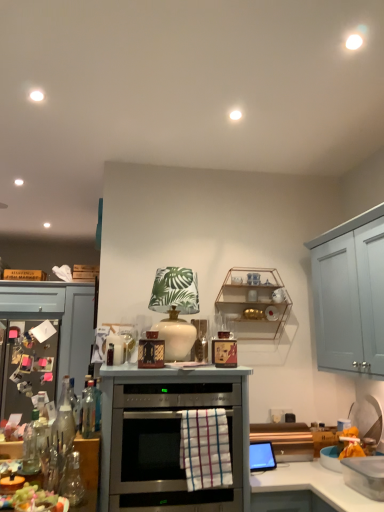
Where is `white ceramic lamp at center, positioned as the first appliance in back-to-front order`? white ceramic lamp at center, positioned as the first appliance in back-to-front order is located at coordinates (175, 309).

At what (x,y) coordinates should I click in order to perform the action: click on satin silver oven at center. Please return your answer as a coordinate pair (x, y). Image resolution: width=384 pixels, height=512 pixels. Looking at the image, I should click on (164, 433).

The height and width of the screenshot is (512, 384). What do you see at coordinates (34, 500) in the screenshot?
I see `translucent glass grapes at lower left` at bounding box center [34, 500].

In order to face clear glass bottle at lower left, the 1th bottle when ordered from left to right, should I rotate leftwards or rightwards?

To align with it, rotate left about 20.449°.

The height and width of the screenshot is (512, 384). What do you see at coordinates (31, 447) in the screenshot?
I see `clear glass bottle at lower left, the second bottle viewed from the right` at bounding box center [31, 447].

Describe the element at coordinates (254, 303) in the screenshot. I see `gold metallic shelf at upper center` at that location.

I want to click on white ceramic lamp at center, positioned as the first appliance in back-to-front order, so click(x=175, y=309).

Considering the relative sizes of translucent glass grapes at lower left and satin silver oven at center in the image provided, is translucent glass grapes at lower left taller than satin silver oven at center?

No, translucent glass grapes at lower left is not taller than satin silver oven at center.

Between translucent glass grapes at lower left and satin silver oven at center, which one has smaller width?

translucent glass grapes at lower left is thinner.

Is translucent glass grapes at lower left smaller than satin silver oven at center?

Yes, translucent glass grapes at lower left is smaller than satin silver oven at center.

What's the angular difference between translucent glass grapes at lower left and satin silver oven at center's facing directions?

translucent glass grapes at lower left and satin silver oven at center are facing 2.37 degrees away from each other.

Is clear glass bottle at center, arranged as the second bottle when viewed from the left, closer to camera compared to clear glass bottle at lower left, the 1th bottle when ordered from left to right?

No, it is behind clear glass bottle at lower left, the 1th bottle when ordered from left to right.

Is clear glass bottle at center, the first bottle when ordered from right to left, outside of clear glass bottle at lower left, the second bottle viewed from the right?

clear glass bottle at center, the first bottle when ordered from right to left, lies outside clear glass bottle at lower left, the second bottle viewed from the right,'s area.

From a real-world perspective, is clear glass bottle at center, arranged as the second bottle when viewed from the left, positioned above or below clear glass bottle at lower left, the second bottle viewed from the right?

In terms of real-world spatial position, clear glass bottle at center, arranged as the second bottle when viewed from the left, is above clear glass bottle at lower left, the second bottle viewed from the right.

Is white checkered towel at center surrounding clear plastic container at lower right, which appears as the second appliance when viewed from the top?

No, clear plastic container at lower right, which appears as the second appliance when viewed from the top, is not inside white checkered towel at center.

How different are the orientations of white checkered towel at center and clear plastic container at lower right, which appears as the second appliance when viewed from the top, in degrees?

The angular difference between white checkered towel at center and clear plastic container at lower right, which appears as the second appliance when viewed from the top, is 90 degrees.

In the scene shown: Who is smaller, white checkered towel at center or clear plastic container at lower right, positioned as the 2th appliance in left-to-right order?

With smaller size is white checkered towel at center.

From a real-world perspective, who is located higher, white checkered towel at center or clear plastic container at lower right, which appears as the second appliance when viewed from the back?

white checkered towel at center is physically above.

Could you tell me if clear plastic container at lower right, marked as the first appliance in a front-to-back arrangement, is facing satin silver oven at center?

Yes, clear plastic container at lower right, marked as the first appliance in a front-to-back arrangement, is aimed at satin silver oven at center.

The image size is (384, 512). I want to click on appliance in front of the satin silver oven at center, so click(x=365, y=475).

Is clear plastic container at lower right, marked as the first appliance in a front-to-back arrangement, positioned beyond the bounds of satin silver oven at center?

That's correct, clear plastic container at lower right, marked as the first appliance in a front-to-back arrangement, is outside of satin silver oven at center.

Which is behind, white checkered towel at center or white ceramic lamp at center, acting as the second appliance starting from the bottom?

white ceramic lamp at center, acting as the second appliance starting from the bottom, is behind.

Can you confirm if white checkered towel at center is wider than white ceramic lamp at center, the 1th appliance in the top-to-bottom sequence?

Incorrect, the width of white checkered towel at center does not surpass that of white ceramic lamp at center, the 1th appliance in the top-to-bottom sequence.

Is white checkered towel at center not close to white ceramic lamp at center, the 2th appliance in the right-to-left sequence?

They are positioned close to each other.

How far apart are gold metallic shelf at upper center and white checkered towel at center?

gold metallic shelf at upper center is 36.76 inches away from white checkered towel at center.

From the image's perspective, who appears lower, gold metallic shelf at upper center or white checkered towel at center?

white checkered towel at center is shown below in the image.

In order to click on material below the gold metallic shelf at upper center (from the image's perspective) in this screenshot , I will do `click(205, 448)`.

From a real-world perspective, who is located lower, gold metallic shelf at upper center or white checkered towel at center?

From a 3D spatial view, white checkered towel at center is below.

Consider the image. Considering the positions of objects white ceramic lamp at center, which is the first appliance in left-to-right order, and translucent glass grapes at lower left in the image provided, who is more to the left, white ceramic lamp at center, which is the first appliance in left-to-right order, or translucent glass grapes at lower left?

From the viewer's perspective, translucent glass grapes at lower left appears more on the left side.

How different are the orientations of white ceramic lamp at center, acting as the second appliance starting from the bottom, and translucent glass grapes at lower left in degrees?

4.79 degrees.

Can you confirm if white ceramic lamp at center, which is the first appliance in left-to-right order, is bigger than translucent glass grapes at lower left?

Correct, white ceramic lamp at center, which is the first appliance in left-to-right order, is larger in size than translucent glass grapes at lower left.

Is white ceramic lamp at center, which ranks as the 2th appliance in front-to-back order, not within translucent glass grapes at lower left?

white ceramic lamp at center, which ranks as the 2th appliance in front-to-back order, is positioned outside translucent glass grapes at lower left.

Where is `oven that appears on the right of translucent glass grapes at lower left`? The width and height of the screenshot is (384, 512). oven that appears on the right of translucent glass grapes at lower left is located at coordinates (164, 433).

What are the coordinates of `bottle in front of the clear glass bottle at center, arranged as the second bottle when viewed from the left` in the screenshot? It's located at (31, 447).

In the scene shown: Which object lies nearer to the anchor point satin silver oven at center, clear glass bottle at center, arranged as the second bottle when viewed from the left, or translucent glass grapes at lower left?

clear glass bottle at center, arranged as the second bottle when viewed from the left, is closer to satin silver oven at center.

Which object lies further to the anchor point white checkered towel at center, white ceramic lamp at center, positioned as the first appliance in back-to-front order, or clear plastic container at lower right, marked as the 1th appliance in a right-to-left arrangement?

clear plastic container at lower right, marked as the 1th appliance in a right-to-left arrangement, is positioned further to the anchor white checkered towel at center.

Looking at the image, which one is located further to gold metallic shelf at upper center, clear plastic container at lower right, the 1th appliance when ordered from bottom to top, or white checkered towel at center?

clear plastic container at lower right, the 1th appliance when ordered from bottom to top, is positioned further to the anchor gold metallic shelf at upper center.

Looking at the image, which one is located further to white checkered towel at center, clear glass bottle at lower left, the second bottle viewed from the right, or clear glass bottle at center, arranged as the second bottle when viewed from the left?

The object further to white checkered towel at center is clear glass bottle at lower left, the second bottle viewed from the right.

From the image, which object appears to be nearer to clear glass bottle at center, the first bottle when ordered from right to left, clear plastic container at lower right, marked as the 1th appliance in a right-to-left arrangement, or translucent glass grapes at lower left?

Based on the image, translucent glass grapes at lower left appears to be nearer to clear glass bottle at center, the first bottle when ordered from right to left.

Estimate the real-world distances between objects in this image. Which object is further from translucent glass grapes at lower left, white ceramic lamp at center, which ranks as the 2th appliance in front-to-back order, or clear glass bottle at lower left, the 1th bottle when ordered from left to right?

Based on the image, white ceramic lamp at center, which ranks as the 2th appliance in front-to-back order, appears to be further to translucent glass grapes at lower left.

From the picture: Estimate the real-world distances between objects in this image. Which object is further from translucent glass grapes at lower left, clear plastic container at lower right, marked as the 1th appliance in a right-to-left arrangement, or satin silver oven at center?

clear plastic container at lower right, marked as the 1th appliance in a right-to-left arrangement.

Based on their spatial positions, is white checkered towel at center or clear glass bottle at center, arranged as the second bottle when viewed from the left, closer to gold metallic shelf at upper center?

Among the two, white checkered towel at center is located nearer to gold metallic shelf at upper center.

Find the location of a particular element. The image size is (384, 512). material between satin silver oven at center and clear plastic container at lower right, which appears as the second appliance when viewed from the top is located at coordinates (205, 448).

I want to click on material between clear glass bottle at lower left, the 1th bottle when ordered from left to right, and gold metallic shelf at upper center from left to right, so click(x=205, y=448).

The image size is (384, 512). Identify the location of appliance between white checkered towel at center and gold metallic shelf at upper center along the z-axis. (175, 309).

You are a GUI agent. You are given a task and a screenshot of the screen. Output one action in this format:
    pyautogui.click(x=<x>, y=<y>)
    Task: Click on the bottle between clear glass bottle at lower left, the 1th bottle when ordered from left to right, and white checkered towel at center from left to right
    The image size is (384, 512).
    Given the screenshot: What is the action you would take?
    91,409